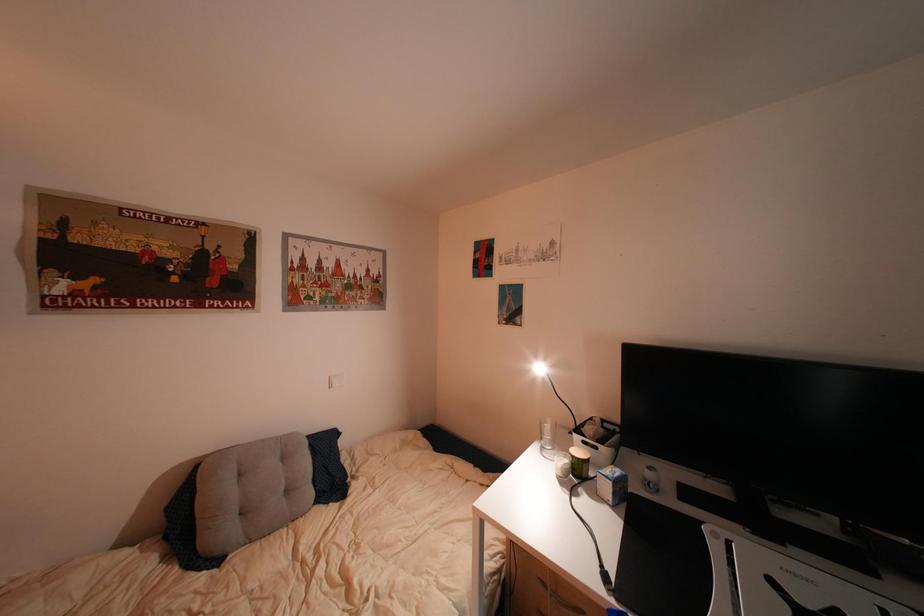
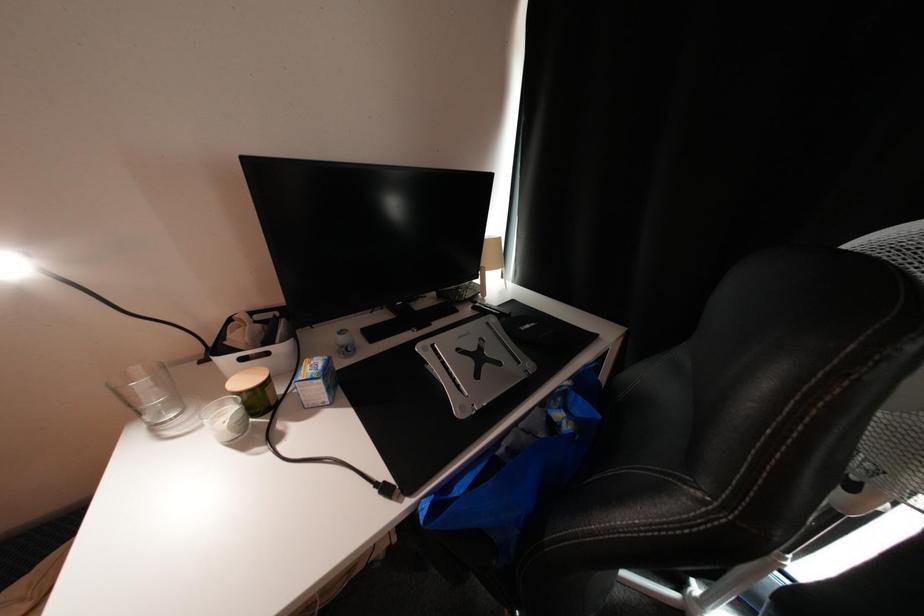
Consider the image. First-person continuous shooting, in which direction is the camera rotating?

The camera's rotation is toward right-down.